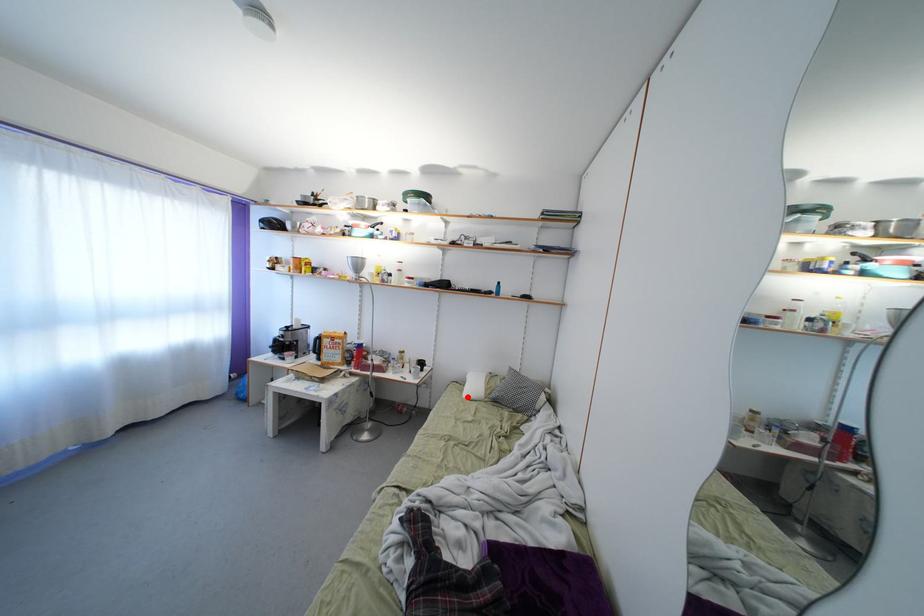
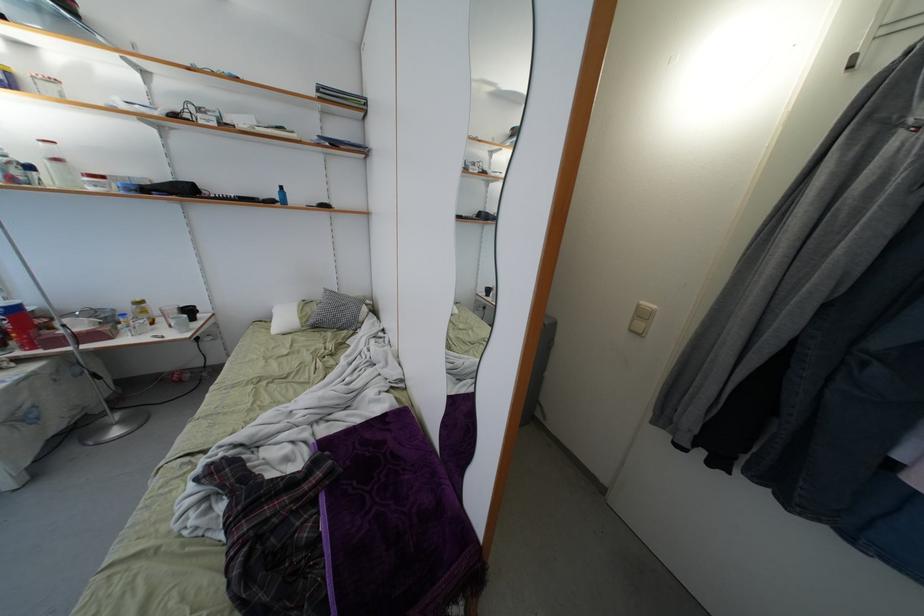
Question: I am providing you with two images of the same scene from different viewpoints. A red point is shown in image1. For the corresponding object point in image2, is it positioned nearer or farther from the camera?

Choices:
 (A) Nearer
 (B) Farther

Answer: (A)